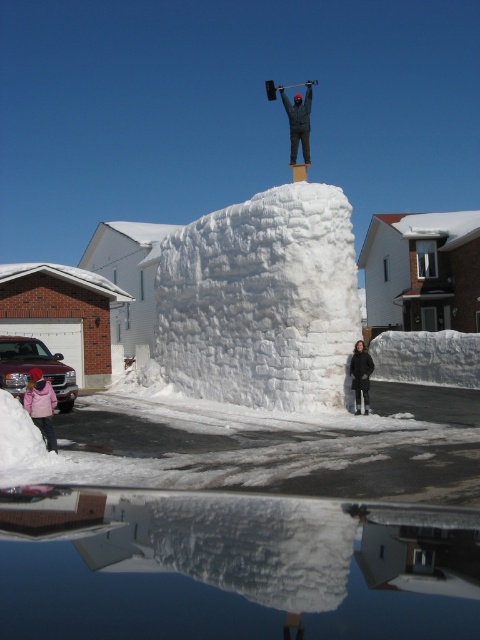
You are standing in the winter scene and want to place a small flag at the point closer to you between point (x=310, y=93) and point (x=364, y=406). Which point should you choose?

You should choose point (x=310, y=93) because it is closer to you than point (x=364, y=406).

From the picture: You are organizing a winter photo shoot and need to place two models wearing the matte pink jacket at lower left and the black matte jacket at lower center. According to the scene, which model should stand to the left of the other to recreate the original image?

The matte pink jacket at lower left should be positioned to the left of the black matte jacket at lower center, as it is already on the left side in the original scene.

You are standing at the point marked by coordinates point (40, 406). Looking towards the snow sculpture, which object is directly in front of you?

The matte pink jacket at lower left is directly in front of you at point (40, 406).